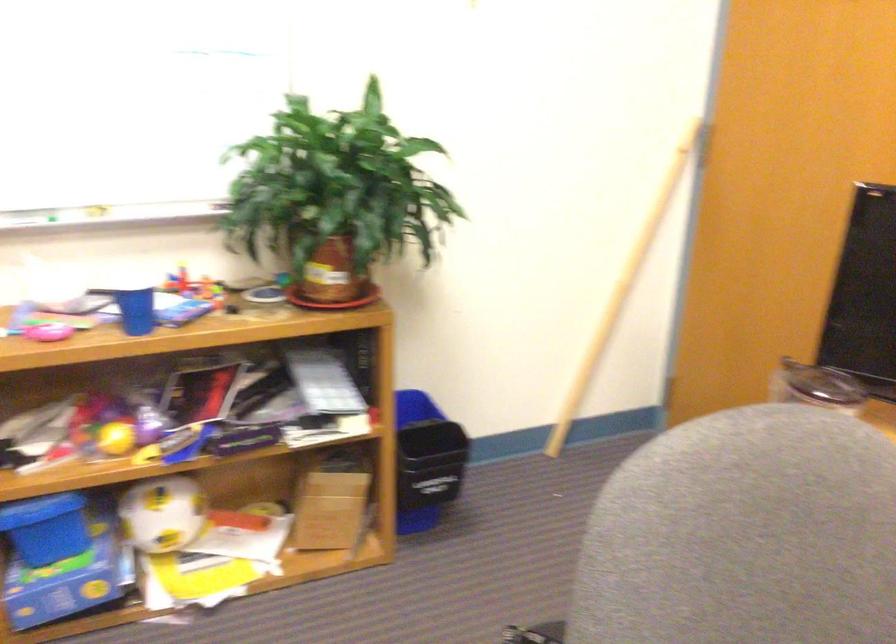
Find the location of a particular element. blue plastic cup is located at coordinates (135, 310).